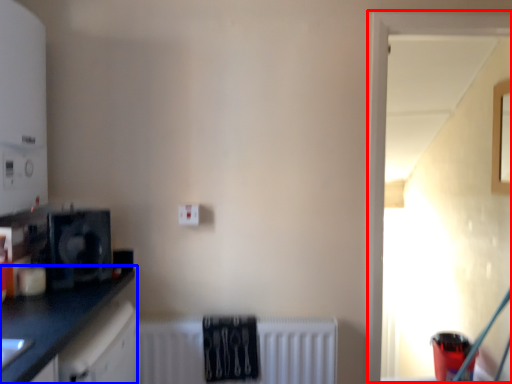
Question: Which object appears farthest to the camera in this image, window (highlighted by a red box) or countertop (highlighted by a blue box)?

Choices:
 (A) window
 (B) countertop

Answer: (A)